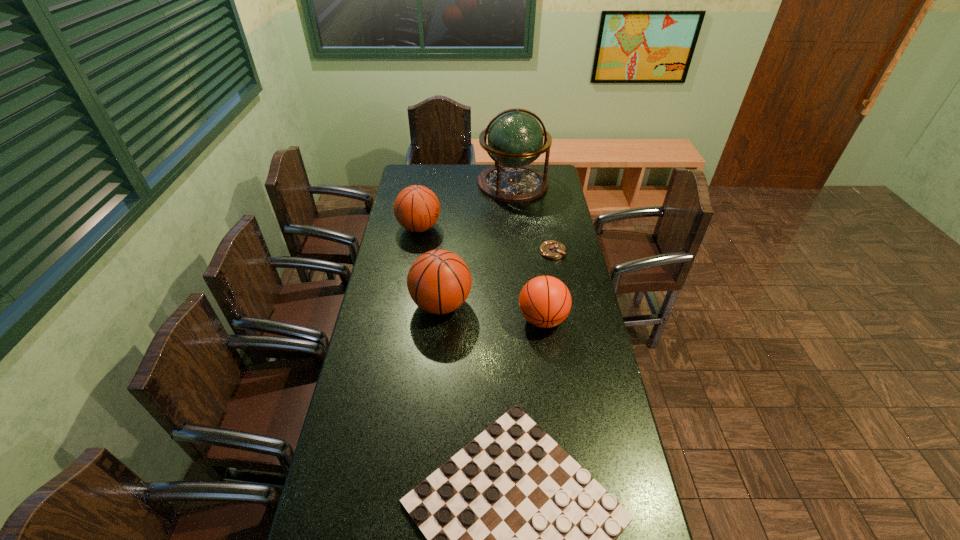
Where is `globe that is at the right edge`? This screenshot has height=540, width=960. globe that is at the right edge is located at coordinates (515, 139).

Find the location of a particular element. Image resolution: width=960 pixels, height=540 pixels. basketball at the right edge is located at coordinates (545, 301).

Find the location of a particular element. ashtray that is at the right edge is located at coordinates (551, 249).

At what (x,y) coordinates should I click in order to perform the action: click on object positioned at the far right corner. Please return your answer as a coordinate pair (x, y). The width and height of the screenshot is (960, 540). Looking at the image, I should click on (515, 139).

Locate an element on the screen. Image resolution: width=960 pixels, height=540 pixels. vacant space at the far edge of the desktop is located at coordinates (452, 182).

This screenshot has height=540, width=960. What are the coordinates of `vacant space at the left edge` in the screenshot? It's located at (368, 505).

Locate an element on the screen. The height and width of the screenshot is (540, 960). blank space at the right edge of the desktop is located at coordinates (591, 339).

Image resolution: width=960 pixels, height=540 pixels. In the image, there is a desktop. In order to click on vacant region at the far left corner in this screenshot , I will do `click(409, 177)`.

The width and height of the screenshot is (960, 540). I want to click on free point between the farthest basketball and the farthest object, so click(x=466, y=206).

Locate an element on the screen. vacant space in between the farthest basketball and the ashtray is located at coordinates (486, 240).